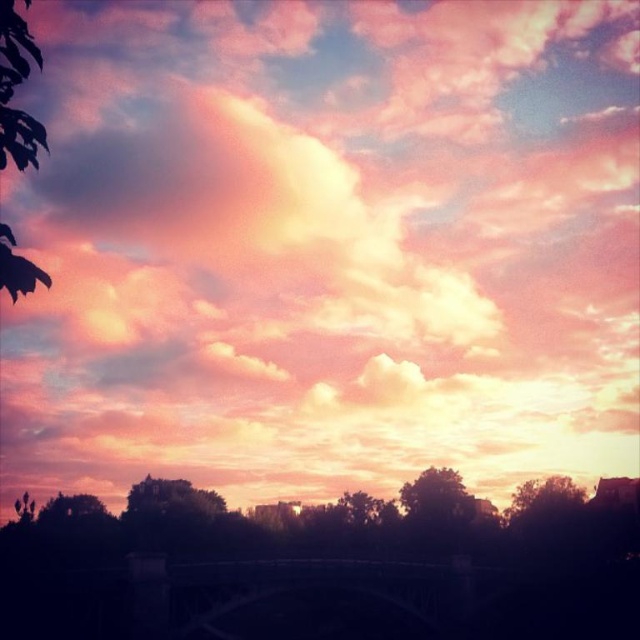
Is green leafy tree at left to the right of silhouetted tree at center from the viewer's perspective?

No, green leafy tree at left is not to the right of silhouetted tree at center.

Who is lower down, green leafy tree at left or silhouetted tree at center?

silhouetted tree at center is below.

Which is in front, point (0, 28) or point (458, 525)?

Point (0, 28)

Find the location of `green leafy tree at left`. green leafy tree at left is located at coordinates (13, 88).

Can you confirm if silhouetted leafy tree at lower right is wider than silhouetted tree at center?

Correct, the width of silhouetted leafy tree at lower right exceeds that of silhouetted tree at center.

Can you confirm if silhouetted leafy tree at lower right is taller than silhouetted tree at center?

Correct, silhouetted leafy tree at lower right is much taller as silhouetted tree at center.

Who is more forward, (541, 484) or (472, 496)?

Positioned in front is point (541, 484).

I want to click on silhouetted leafy tree at lower right, so click(x=545, y=506).

Does green leafy tree at left have a smaller size compared to silhouetted leafy tree at lower right?

Actually, green leafy tree at left might be larger than silhouetted leafy tree at lower right.

Who is positioned more to the right, green leafy tree at left or silhouetted leafy tree at lower right?

From the viewer's perspective, silhouetted leafy tree at lower right appears more on the right side.

What do you see at coordinates (13, 88) in the screenshot? Image resolution: width=640 pixels, height=640 pixels. I see `green leafy tree at left` at bounding box center [13, 88].

Where is `green leafy tree at left`? This screenshot has height=640, width=640. green leafy tree at left is located at coordinates (13, 88).